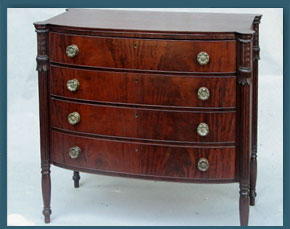
Identify the location of right front leg. The width and height of the screenshot is (290, 229). (247, 154).